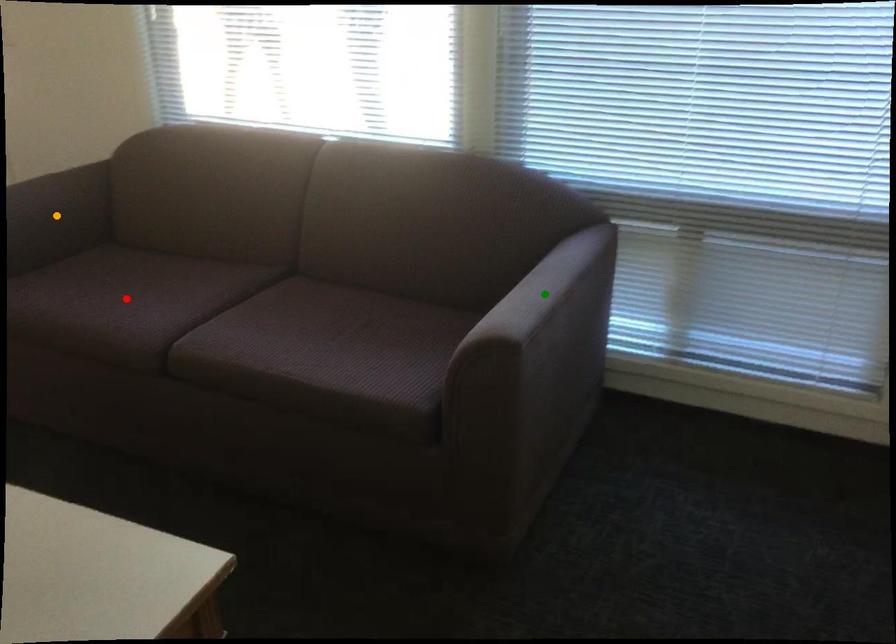
Order these from nearest to farthest:
red point
orange point
green point

green point, red point, orange point